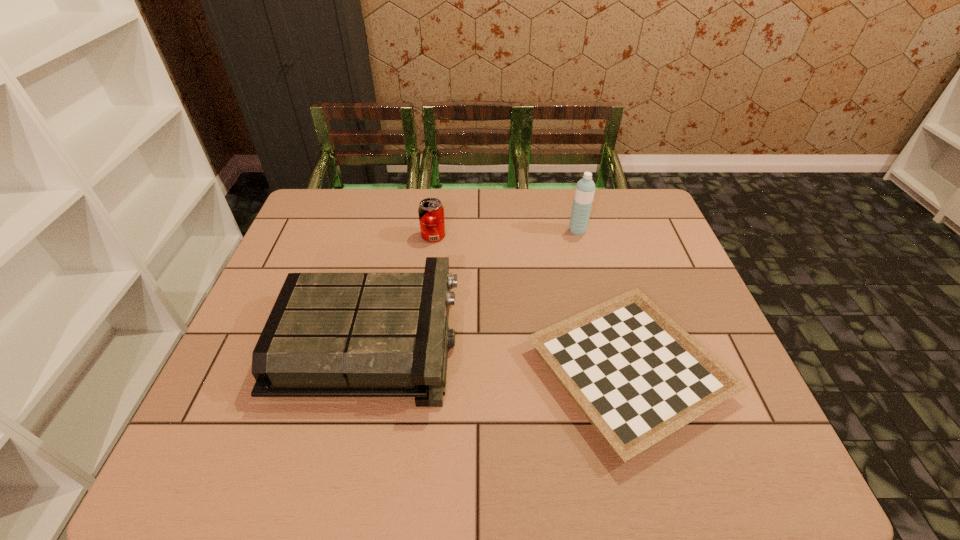
This screenshot has height=540, width=960. Identify the location of the tallest object. (585, 188).

The width and height of the screenshot is (960, 540). What are the coordinates of `soda can` in the screenshot? It's located at (431, 212).

The image size is (960, 540). I want to click on radio receiver, so click(x=329, y=334).

Where is `the shortest object`? The image size is (960, 540). the shortest object is located at coordinates (637, 376).

The height and width of the screenshot is (540, 960). What are the coordinates of `vacant position located on the left of the tallest object` in the screenshot? It's located at 537,231.

I want to click on vacant space positioned 0.230m on the left of the soda can, so click(347, 236).

The width and height of the screenshot is (960, 540). In order to click on vacant region located 0.350m on the front panel of the radio receiver in this screenshot , I will do `click(601, 340)`.

You are a GUI agent. You are given a task and a screenshot of the screen. Output one action in this format:
    pyautogui.click(x=<x>, y=<y>)
    Task: Click on the blank space located 0.100m on the left of the checkerboard
    The width and height of the screenshot is (960, 540).
    Given the screenshot: What is the action you would take?
    pyautogui.click(x=483, y=372)

You are a GUI agent. You are given a task and a screenshot of the screen. Output one action in this format:
    pyautogui.click(x=<x>, y=<y>)
    Task: Click on the water bottle that is at the far edge
    This screenshot has width=960, height=540.
    Given the screenshot: What is the action you would take?
    pyautogui.click(x=585, y=188)

Where is `soda can present at the far edge`? The image size is (960, 540). soda can present at the far edge is located at coordinates (431, 212).